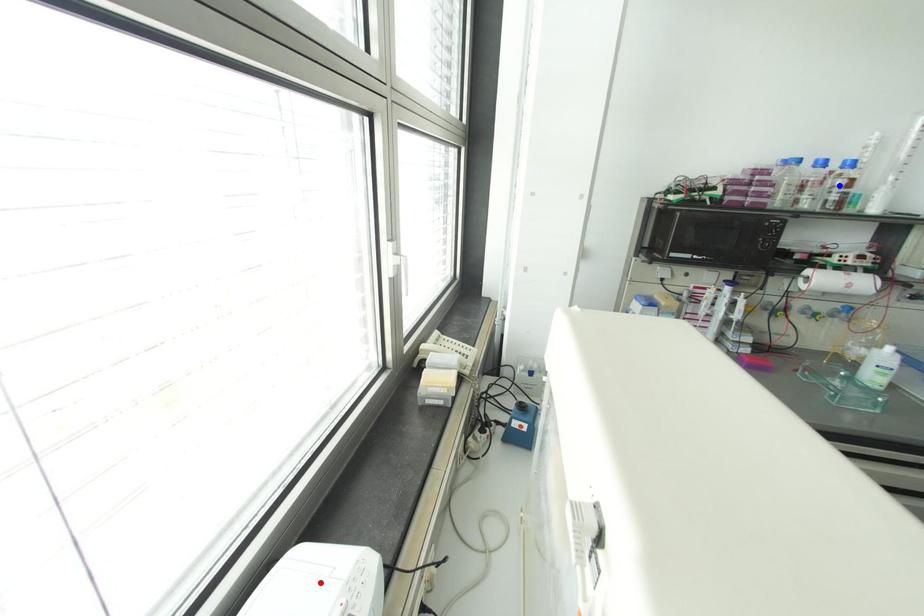
Question: In the image, two points are highlighted. Which point is nearer to the camera? Reply with the corresponding letter.

Choices:
 (A) blue point
 (B) red point

Answer: (B)